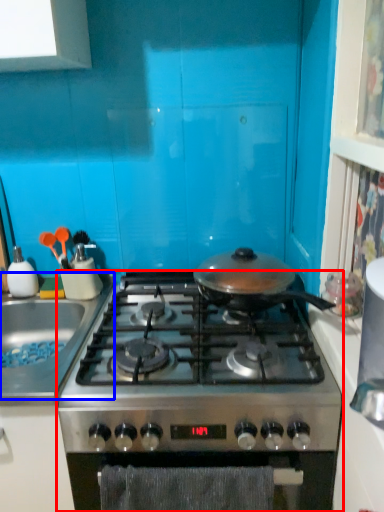
Question: Which object appears closest to the camera in this image, gas stove (highlighted by a red box) or sink (highlighted by a blue box)?

Choices:
 (A) gas stove
 (B) sink

Answer: (A)